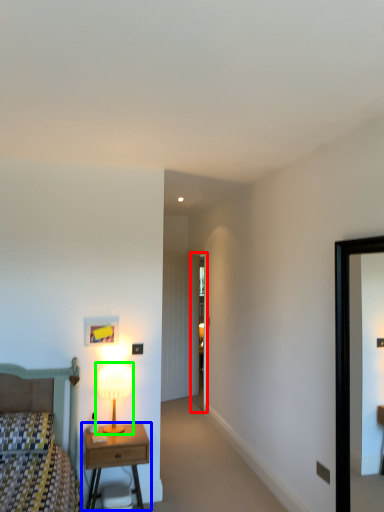
Question: Considering the real-world distances, which object is closest to glass door (highlighted by a red box)? nightstand (highlighted by a blue box) or table lamp (highlighted by a green box).

Choices:
 (A) nightstand
 (B) table lamp

Answer: (B)